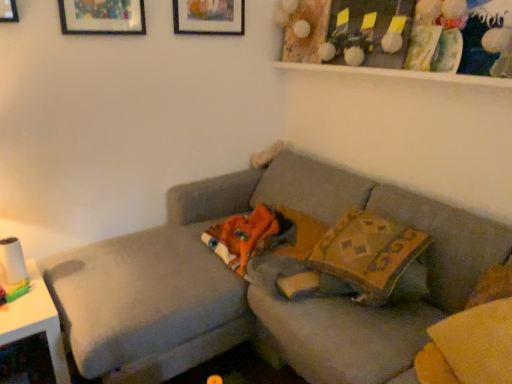
The width and height of the screenshot is (512, 384). Find the location of `free space above patterned fabric pillow at center (from a real-world perspective)`. free space above patterned fabric pillow at center (from a real-world perspective) is located at coordinates (380, 246).